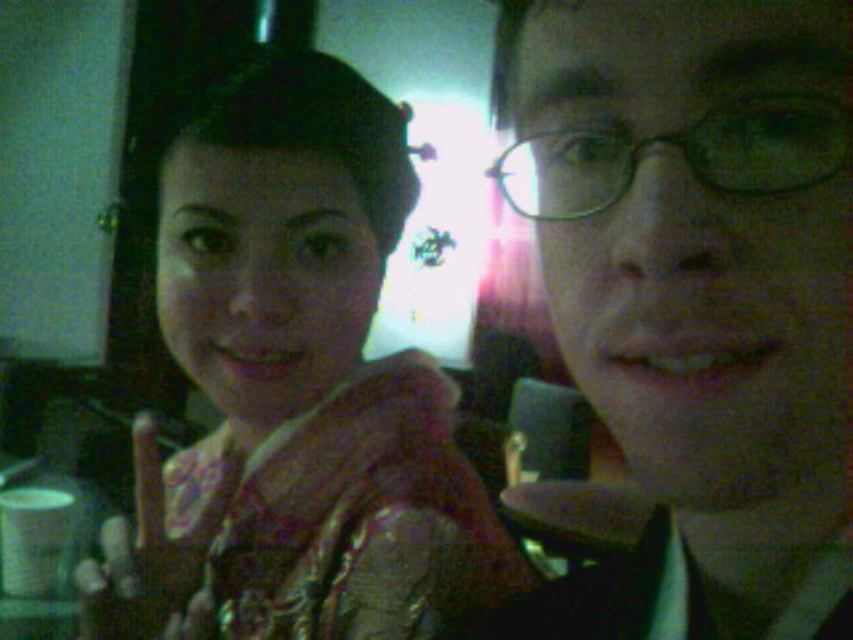
Can you confirm if matte black glasses at center is thinner than shiny gold dress at center?

Yes, matte black glasses at center is thinner than shiny gold dress at center.

Is matte black glasses at center positioned behind shiny gold dress at center?

That is False.

This screenshot has width=853, height=640. What do you see at coordinates (695, 301) in the screenshot?
I see `matte black glasses at center` at bounding box center [695, 301].

Where is `matte black glasses at center`? The image size is (853, 640). matte black glasses at center is located at coordinates (x=695, y=301).